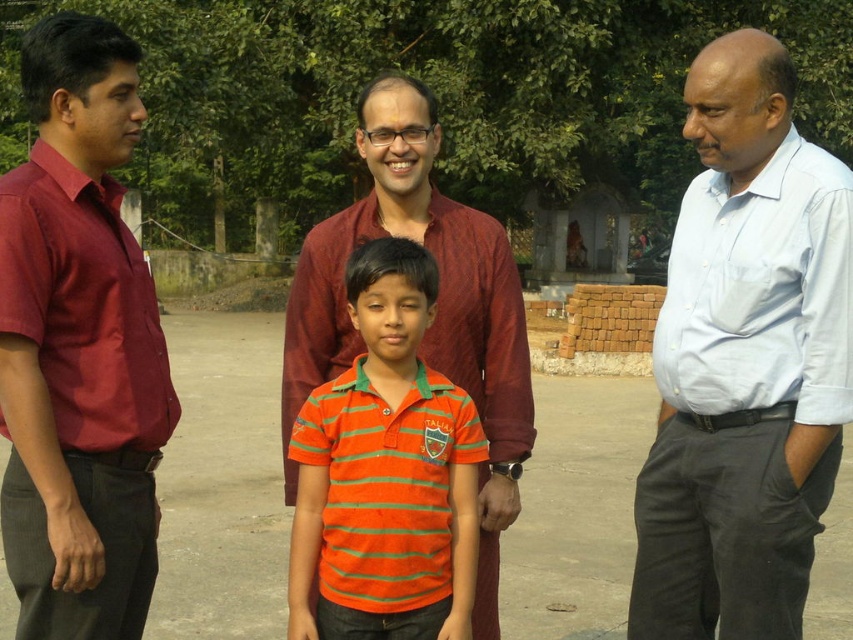
Question: Is light blue shirt at right closer to the viewer compared to light blue cotton shirt at right?

Choices:
 (A) no
 (B) yes

Answer: (A)

Question: Which point is closer to the camera?

Choices:
 (A) (672, 349)
 (B) (426, 550)

Answer: (B)

Question: Can you confirm if light blue shirt at right is bigger than maroon shirt at left?

Choices:
 (A) no
 (B) yes

Answer: (B)

Question: Which of the following is the farthest from the observer?

Choices:
 (A) tap(825, 262)
 (B) tap(378, 492)
 (C) tap(815, 316)
 (D) tap(32, 337)

Answer: (C)

Question: Which point is closer to the camera taking this photo?

Choices:
 (A) (19, 227)
 (B) (732, 77)
 (C) (326, 456)

Answer: (A)

Question: Does maroon shirt at left appear over orange striped polo shirt at center?

Choices:
 (A) no
 (B) yes

Answer: (B)